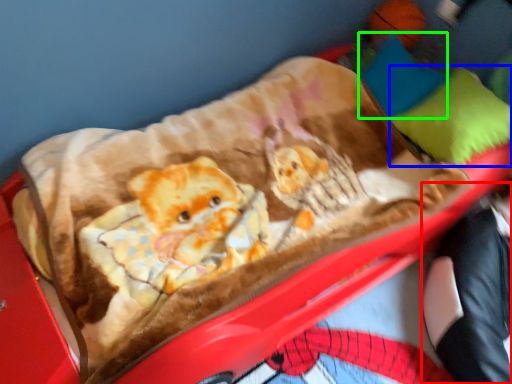
Question: Which object is the closest to the couple (highlighted by a red box)? Choose among these: pillow (highlighted by a blue box) or pillow (highlighted by a green box).

Choices:
 (A) pillow
 (B) pillow

Answer: (A)